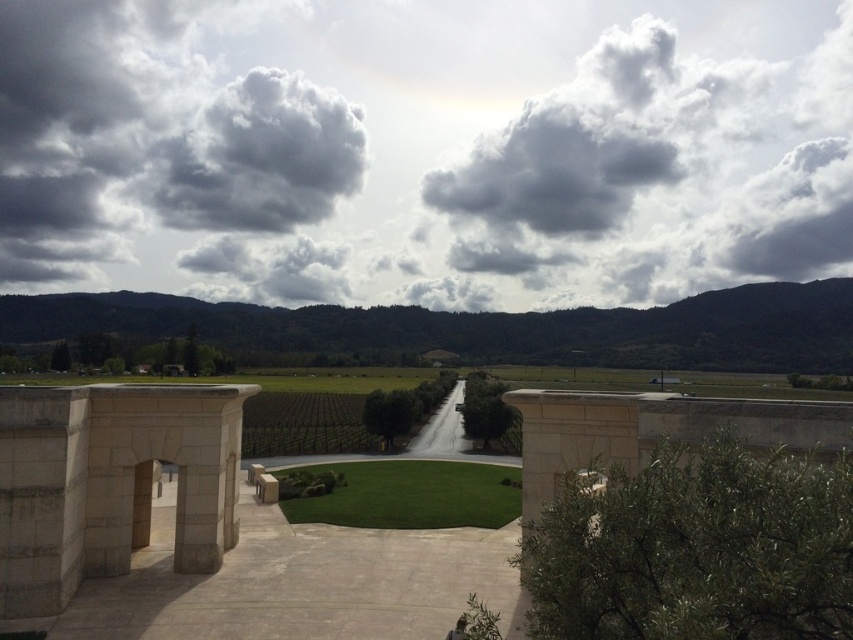
You are an architect designing a new garden and want to place a statue in the center of the paved area. The statue requires a clear space that is as wide as the cloudy sky at upper center. Can the statue fit within the paved area if the paved area is the same size as the dark gray fluffy cloud at upper left?

The cloudy sky at upper center is bigger than the dark gray fluffy cloud at upper left. Since the statue requires a clear space as wide as the cloudy sky at upper center, it cannot fit within the paved area, which is the same size as the smaller dark gray fluffy cloud at upper left.

You are an astronomer analyzing the sky in the image. You notice the dark gray fluffy cloud at upper left. What are its coordinates?

The dark gray fluffy cloud at upper left is located at coordinates point (260, 157).

You are standing in the foreground of the landscape and want to take a photo. There are two points marked in the image, point 1 at coordinates point (282,145) and point 2 at coordinates point (500,493). Which point is closer to your current position?

Point (282,145) is closer to your current position because it is further to the camera than point (500,493).